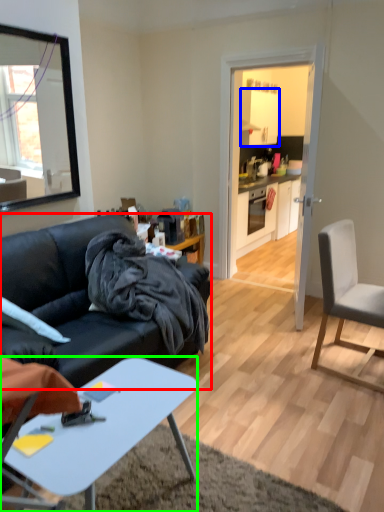
Question: Which object is positioned farthest from studio couch (highlighted by a red box)? Select from cabinetry (highlighted by a blue box) and desk (highlighted by a green box).

Choices:
 (A) cabinetry
 (B) desk

Answer: (A)